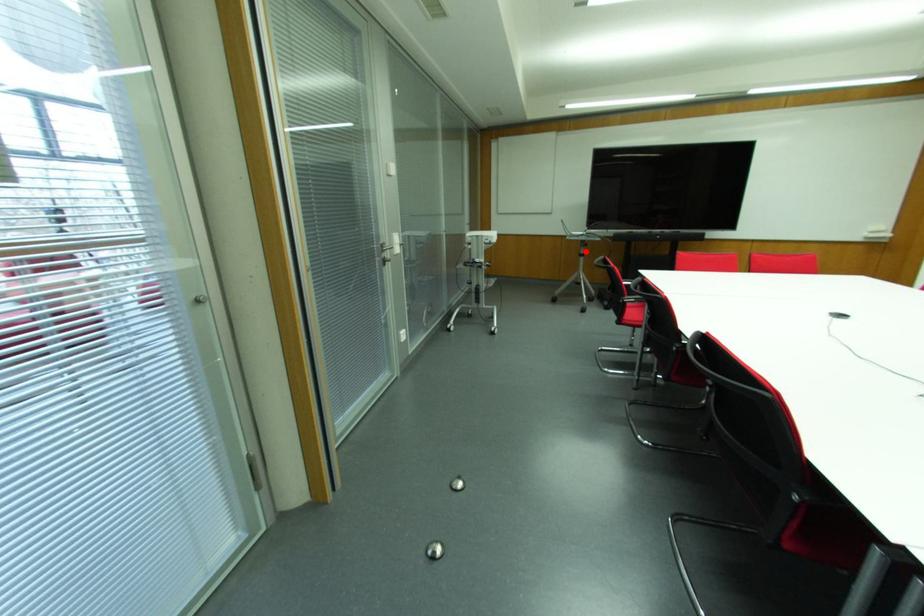
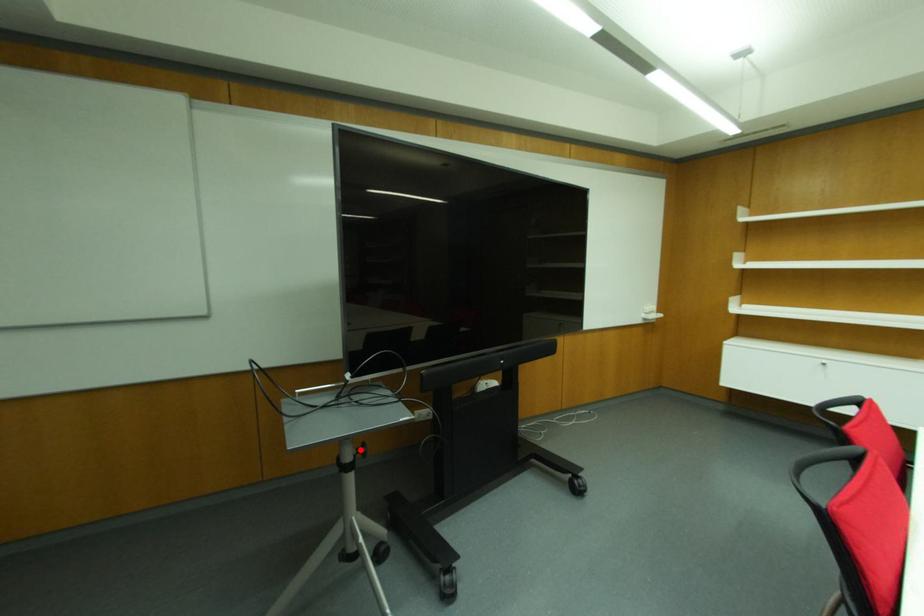
I am providing you with two images of the same scene from different viewpoints. A red point is marked on the first image and another point is marked on the second image. Are the points marked in image1 and image2 representing the same 3D position?

Yes